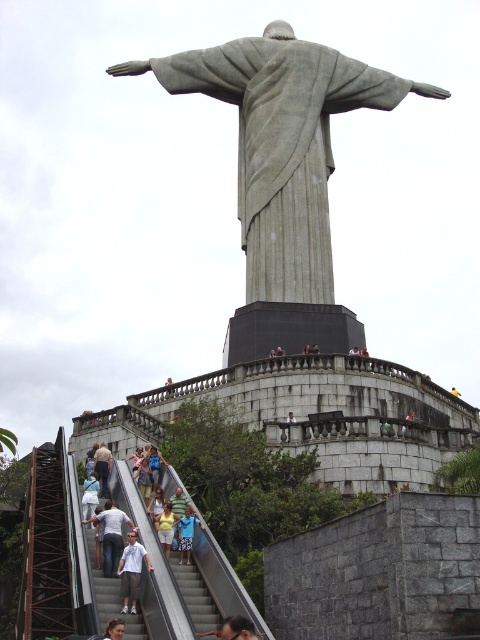
You are a photographer planning to capture the gray stone statue at upper center and the light gray jeans at lower center in the same frame. Considering their sizes, which object should you focus on first to ensure both are in the frame without cropping?

The gray stone statue at upper center is wider than the light gray jeans at lower center, so you should focus on the gray stone statue at upper center first to ensure both fit in the frame without cropping.